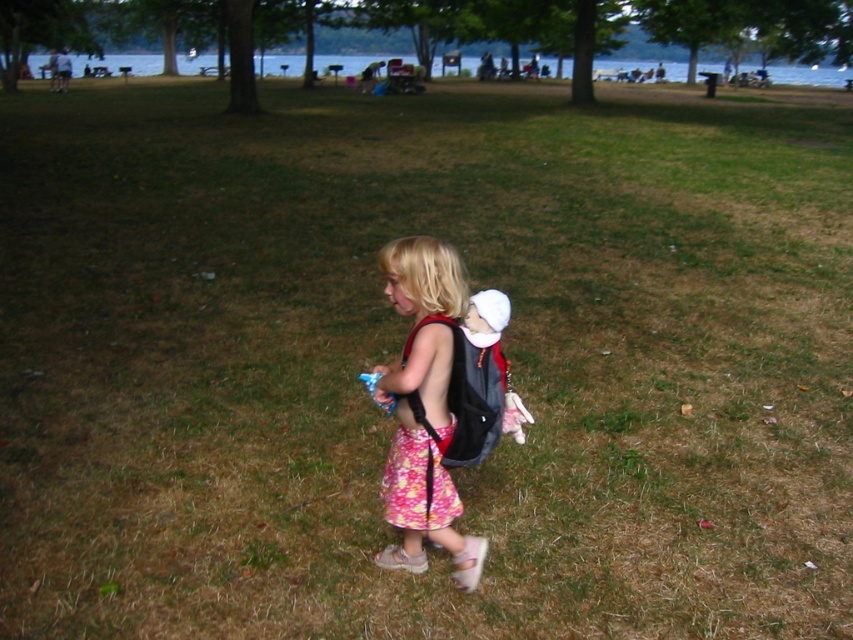
Between floral cotton skirt at center and floral fabric dress at center, which one appears on the left side from the viewer's perspective?

Positioned to the left is floral fabric dress at center.

Measure the distance between floral cotton skirt at center and floral fabric dress at center.

floral cotton skirt at center and floral fabric dress at center are 1.84 inches apart.

Which is in front, point (465, 544) or point (389, 474)?

Point (465, 544) is in front.

You are a GUI agent. You are given a task and a screenshot of the screen. Output one action in this format:
    pyautogui.click(x=<x>, y=<y>)
    Task: Click on the floral cotton skirt at center
    The width and height of the screenshot is (853, 640).
    Given the screenshot: What is the action you would take?
    pyautogui.click(x=422, y=408)